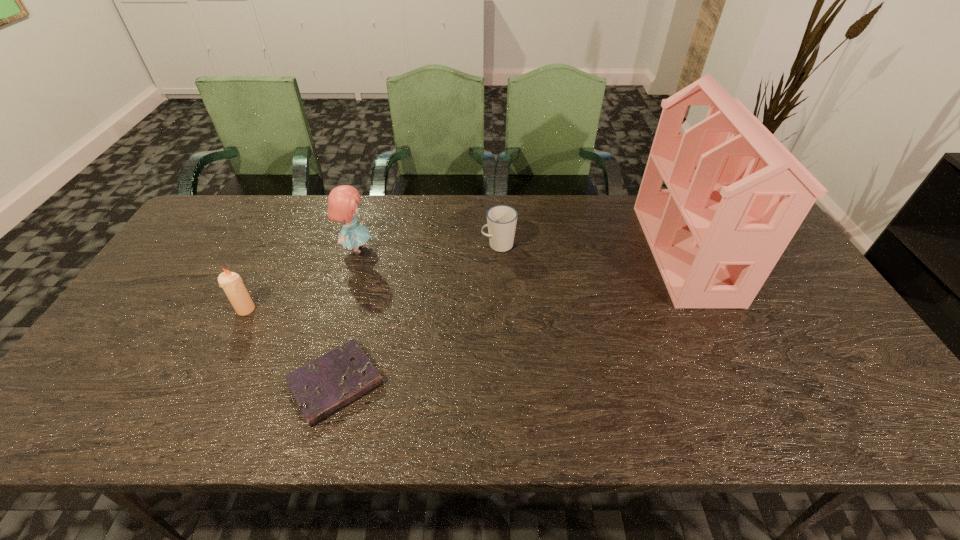
You are a GUI agent. You are given a task and a screenshot of the screen. Output one action in this format:
    pyautogui.click(x=<x>, y=<y>)
    Task: Click on the free spot located 0.400m on the front-facing side of the tallest object
    
    Given the screenshot: What is the action you would take?
    pyautogui.click(x=517, y=253)

Where is `free space located 0.130m on the front-facing side of the tallest object`? free space located 0.130m on the front-facing side of the tallest object is located at coordinates (607, 253).

Find the location of a particular element. The height and width of the screenshot is (540, 960). free location located on the front-facing side of the doll is located at coordinates (440, 249).

The image size is (960, 540). I want to click on vacant area situated 0.130m on the front of the third shortest object, so click(x=222, y=357).

Locate an element on the screen. This screenshot has width=960, height=540. blank space located with a handle on the side of the fourth tallest object is located at coordinates (404, 245).

Locate an element on the screen. Image resolution: width=960 pixels, height=540 pixels. free region located 0.210m with a handle on the side of the fourth tallest object is located at coordinates (414, 245).

Identify the location of vacant space located 0.230m with a handle on the side of the fourth tallest object. (407, 245).

Locate an element on the screen. This screenshot has height=540, width=960. free space located on the left of the diary is located at coordinates (175, 383).

Find the location of `dollhouse positioned at the far edge`. dollhouse positioned at the far edge is located at coordinates (736, 196).

I want to click on doll that is at the far edge, so click(x=342, y=202).